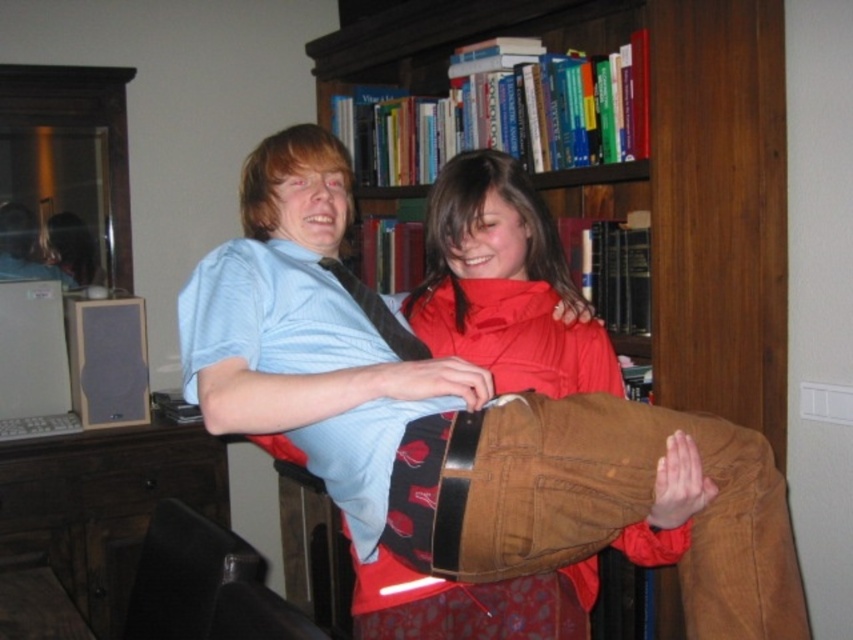
You are a delivery person trying to place a package on the wooden bookshelf at upper center. According to the coordinates provided, where exactly should you place the package?

The wooden bookshelf at upper center is located at coordinates point (646,168), so place the package there.